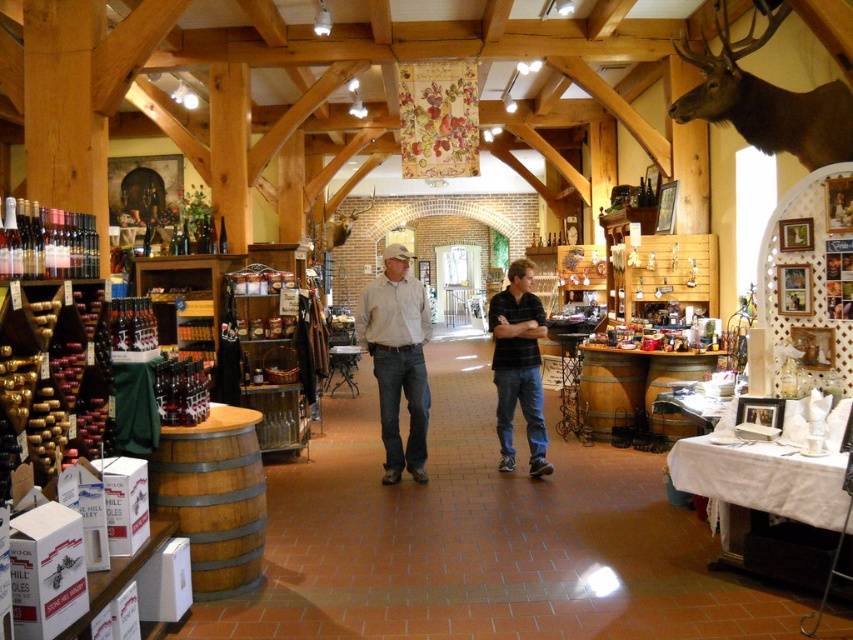
Question: Can you confirm if brown wooden barrel at lower left is smaller than black cotton shirt at center?

Choices:
 (A) yes
 (B) no

Answer: (A)

Question: Is brown wooden barrel at lower left behind black cotton shirt at center?

Choices:
 (A) yes
 (B) no

Answer: (B)

Question: Observing the image, what is the correct spatial positioning of light brown jeans at center in reference to light brown denim jeans at center?

Choices:
 (A) below
 (B) above

Answer: (A)

Question: Which is farther from the brown wooden barrel at lower left?

Choices:
 (A) black cotton shirt at center
 (B) light brown jeans at center

Answer: (A)

Question: Which of the following is the farthest from the observer?

Choices:
 (A) (508, 291)
 (B) (163, 481)
 (C) (368, 301)

Answer: (A)

Question: Which of these objects is positioned closest to the light brown denim jeans at center?

Choices:
 (A) black cotton shirt at center
 (B) light brown jeans at center
 (C) brown wooden barrel at lower left

Answer: (B)